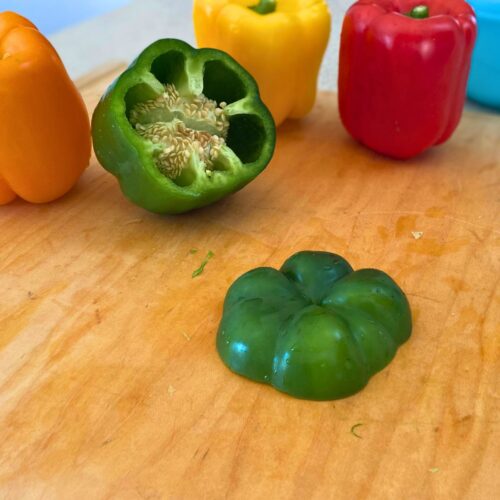
In order to click on tabletop in this screenshot , I will do `click(231, 405)`.